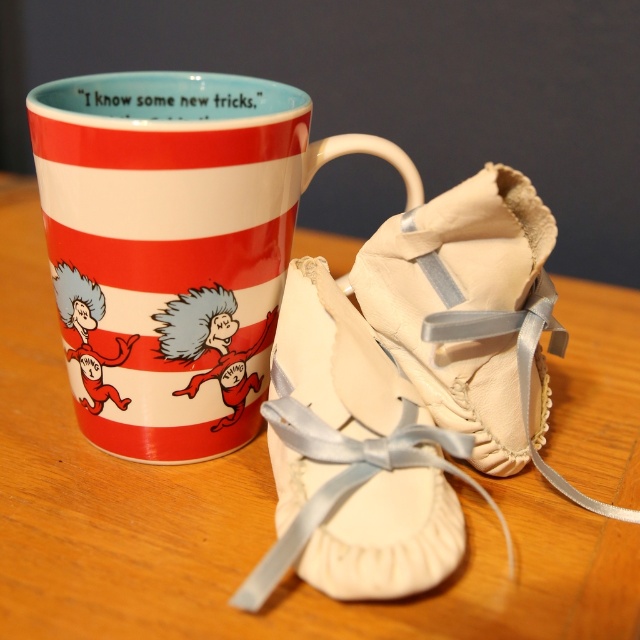
Question: Which object is positioned closest to the beige leather ballet shoes at center?

Choices:
 (A) wooden table at center
 (B) matte ceramic mug at upper center

Answer: (A)

Question: Can you confirm if white satin ballet shoes at center is bigger than beige leather ballet shoes at center?

Choices:
 (A) yes
 (B) no

Answer: (A)

Question: Where is matte ceramic mug at upper center located in relation to beige leather ballet shoes at center in the image?

Choices:
 (A) below
 (B) above

Answer: (B)

Question: Which of these objects is positioned farthest from the matte ceramic mug at upper center?

Choices:
 (A) white satin ballet shoes at center
 (B) wooden table at center

Answer: (B)

Question: Which point is farther to the camera?

Choices:
 (A) white satin ballet shoes at center
 (B) beige leather ballet shoes at center
 (C) wooden table at center

Answer: (B)

Question: Is matte ceramic mug at upper center thinner than beige leather ballet shoes at center?

Choices:
 (A) yes
 (B) no

Answer: (B)